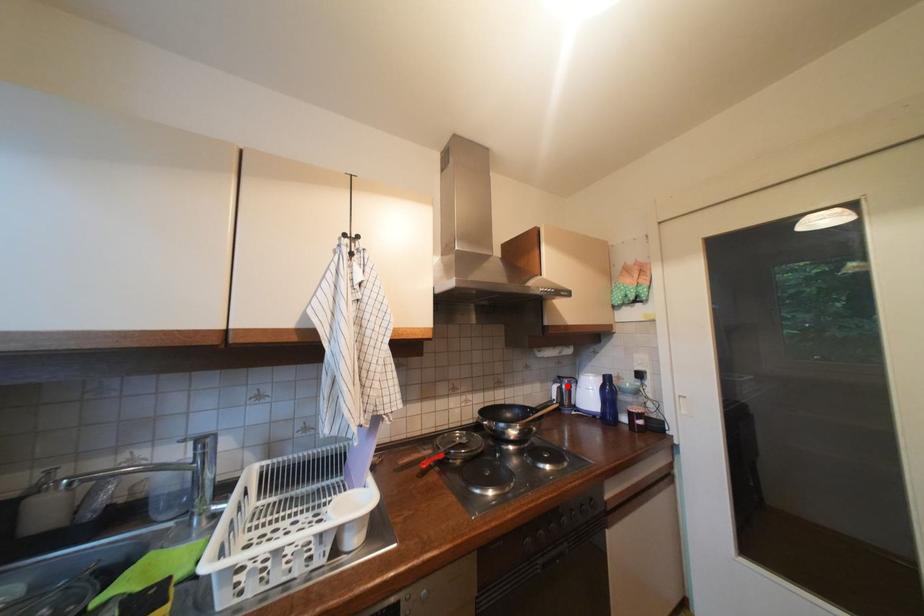
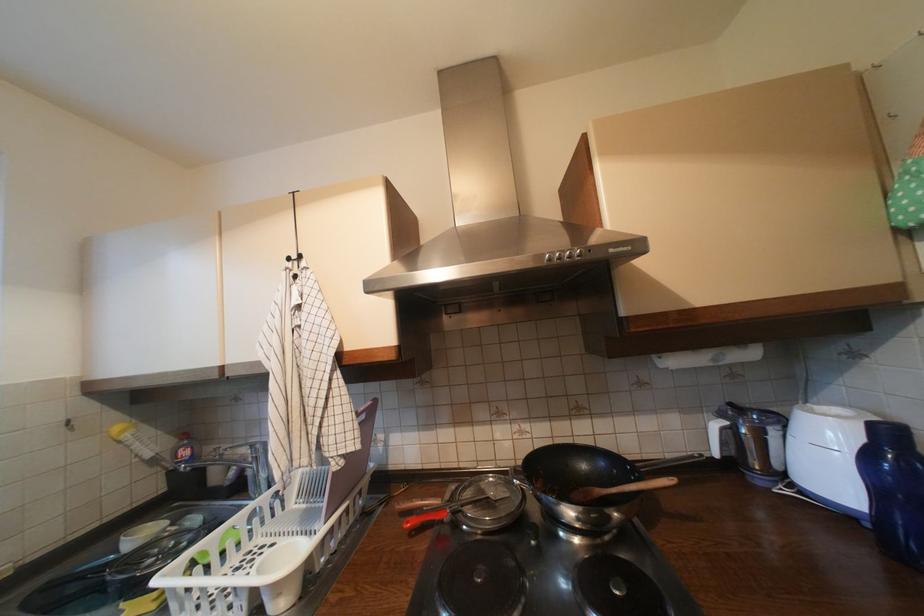
Locate, in the second image, the point that corresponds to the highlighted location in the first image.

(735, 424)